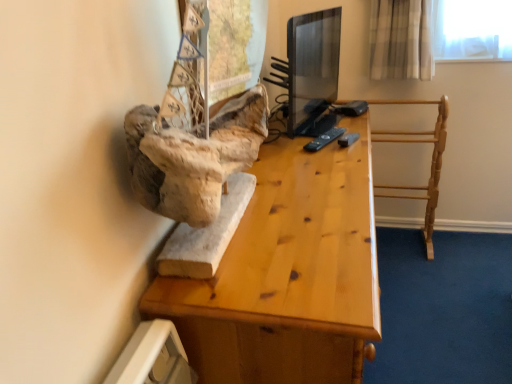
Question: Is black plastic remote at center shorter than wooden desk at center?

Choices:
 (A) yes
 (B) no

Answer: (A)

Question: Is black plastic remote at center closer to camera compared to wooden desk at center?

Choices:
 (A) yes
 (B) no

Answer: (B)

Question: Would you say black plastic remote at center is outside wooden desk at center?

Choices:
 (A) yes
 (B) no

Answer: (B)

Question: From a real-world perspective, is black plastic remote at center physically below wooden desk at center?

Choices:
 (A) no
 (B) yes

Answer: (A)

Question: Can you confirm if black plastic remote at center is thinner than wooden desk at center?

Choices:
 (A) yes
 (B) no

Answer: (A)

Question: Choose the correct answer: Is light wood towel rack at right inside black plastic remote at center or outside it?

Choices:
 (A) outside
 (B) inside

Answer: (A)

Question: Is point (433, 206) closer or farther from the camera than point (335, 127)?

Choices:
 (A) closer
 (B) farther

Answer: (B)

Question: Relative to black plastic remote at center, is light wood towel rack at right in front or behind?

Choices:
 (A) front
 (B) behind

Answer: (B)

Question: In terms of height, does light wood towel rack at right look taller or shorter compared to black plastic remote at center?

Choices:
 (A) short
 (B) tall

Answer: (B)

Question: Is black plastic remote at center in front of or behind light wood towel rack at right in the image?

Choices:
 (A) behind
 (B) front

Answer: (B)

Question: In terms of width, does black plastic remote at center look wider or thinner when compared to light wood towel rack at right?

Choices:
 (A) wide
 (B) thin

Answer: (B)

Question: Considering the positions of point (343, 130) and point (436, 142), is point (343, 130) closer or farther from the camera than point (436, 142)?

Choices:
 (A) closer
 (B) farther

Answer: (A)

Question: Choose the correct answer: Is black plastic remote at center inside light wood towel rack at right or outside it?

Choices:
 (A) inside
 (B) outside

Answer: (B)

Question: Considering the positions of wooden desk at center and light wood towel rack at right in the image, is wooden desk at center wider or thinner than light wood towel rack at right?

Choices:
 (A) wide
 (B) thin

Answer: (A)

Question: Is wooden desk at center taller or shorter than light wood towel rack at right?

Choices:
 (A) short
 (B) tall

Answer: (B)